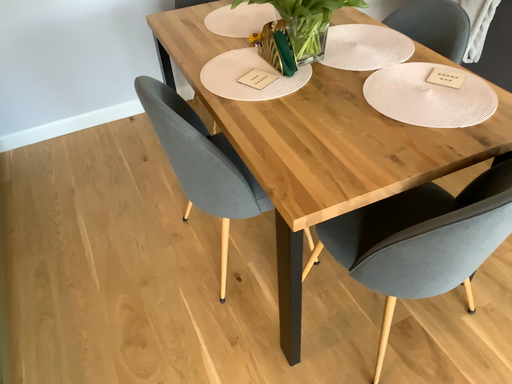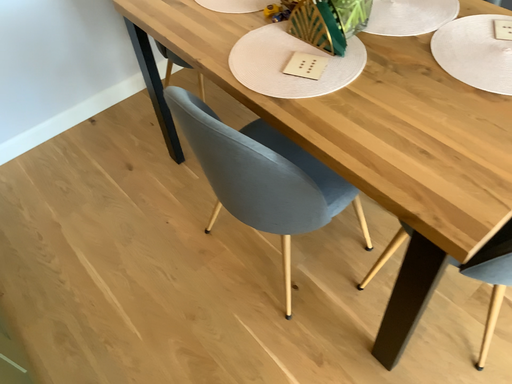
Question: Which way did the camera rotate in the video?

Choices:
 (A) rotated left
 (B) rotated right

Answer: (B)